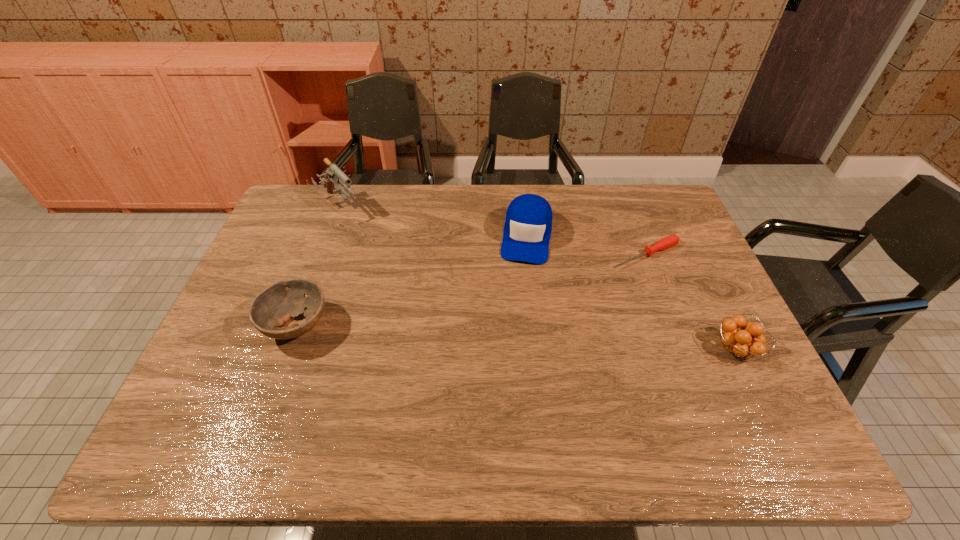
Find the location of a particular element. The width and height of the screenshot is (960, 540). vacant spot on the desktop that is between the bowl and the orange fruit and is positioned at the barrel end of the gun is located at coordinates (x=460, y=334).

Identify the location of free space on the desktop that is between the bowl and the orange fruit and is positioned on the front-facing side of the fourth shortest object. [x=510, y=337].

Find the location of a particular element. The image size is (960, 540). free space on the desktop that is between the bowl and the orange fruit and is positioned at the tip of the shortest object is located at coordinates (473, 335).